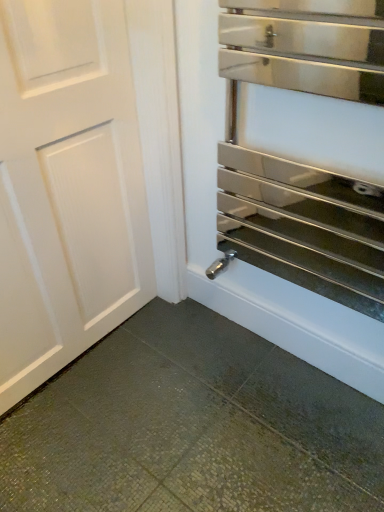
Locate an element on the screen. white matte door at left is located at coordinates (67, 187).

Describe the element at coordinates (67, 187) in the screenshot. The width and height of the screenshot is (384, 512). I see `white matte door at left` at that location.

Identify the location of polished stainless steel oven at right. pos(247,264).

The width and height of the screenshot is (384, 512). Describe the element at coordinates (247, 264) in the screenshot. I see `polished stainless steel oven at right` at that location.

Find the location of `white matte door at left`. white matte door at left is located at coordinates (67, 187).

Considering the relative positions of white matte door at left and polished stainless steel oven at right in the image provided, is white matte door at left to the right of polished stainless steel oven at right from the viewer's perspective?

No.

In the image, is white matte door at left positioned in front of or behind polished stainless steel oven at right?

white matte door at left is behind polished stainless steel oven at right.

Is point (47, 184) farther from viewer compared to point (246, 307)?

That is False.

From the image's perspective, is white matte door at left above polished stainless steel oven at right?

No.

From a real-world perspective, which object stands above the other?

From a 3D spatial view, polished stainless steel oven at right is above.

Considering the sizes of objects white matte door at left and polished stainless steel oven at right in the image provided, who is wider, white matte door at left or polished stainless steel oven at right?

Wider between the two is polished stainless steel oven at right.

In terms of height, does white matte door at left look taller or shorter compared to polished stainless steel oven at right?

Considering their sizes, white matte door at left has more height than polished stainless steel oven at right.

Considering the relative sizes of white matte door at left and polished stainless steel oven at right in the image provided, is white matte door at left bigger than polished stainless steel oven at right?

Yes, white matte door at left is bigger than polished stainless steel oven at right.

Is white matte door at left outside of polished stainless steel oven at right?

That's correct, white matte door at left is outside of polished stainless steel oven at right.

Is there a large distance between white matte door at left and polished stainless steel oven at right?

white matte door at left is near polished stainless steel oven at right, not far away.

Is white matte door at left oriented towards polished stainless steel oven at right?

Yes, white matte door at left faces towards polished stainless steel oven at right.

How different are the orientations of white matte door at left and polished stainless steel oven at right in degrees?

They differ by 89.5 degrees in their facing directions.

Locate an element on the screen. The image size is (384, 512). oven in front of the white matte door at left is located at coordinates (x=247, y=264).

Which object is positioned more to the left, polished stainless steel oven at right or white matte door at left?

From the viewer's perspective, white matte door at left appears more on the left side.

Is polished stainless steel oven at right further to the viewer compared to white matte door at left?

No, the depth of polished stainless steel oven at right is less than that of white matte door at left.

Which is behind, point (176, 42) or point (118, 317)?

The point (118, 317) is farther from the camera.

From the image's perspective, would you say polished stainless steel oven at right is positioned over white matte door at left?

Indeed, from the image's perspective, polished stainless steel oven at right is shown above white matte door at left.

From a real-world perspective, which is physically below, polished stainless steel oven at right or white matte door at left?

In real-world perspective, white matte door at left is lower.

Considering the sizes of objects polished stainless steel oven at right and white matte door at left in the image provided, who is wider, polished stainless steel oven at right or white matte door at left?

polished stainless steel oven at right.

Considering the relative sizes of polished stainless steel oven at right and white matte door at left in the image provided, is polished stainless steel oven at right shorter than white matte door at left?

Yes, polished stainless steel oven at right is shorter than white matte door at left.

Between polished stainless steel oven at right and white matte door at left, which one has larger size?

With larger size is white matte door at left.

Choose the correct answer: Is polished stainless steel oven at right inside white matte door at left or outside it?

polished stainless steel oven at right is not enclosed by white matte door at left.

Is polished stainless steel oven at right far from white matte door at left?

No, there isn't a large distance between polished stainless steel oven at right and white matte door at left.

Is polished stainless steel oven at right aimed at white matte door at left?

No, polished stainless steel oven at right does not turn towards white matte door at left.

How many degrees apart are the facing directions of polished stainless steel oven at right and white matte door at left?

The angular difference between polished stainless steel oven at right and white matte door at left is 89.5 degrees.

Where is `door below the polished stainless steel oven at right (from a real-world perspective)`? The image size is (384, 512). door below the polished stainless steel oven at right (from a real-world perspective) is located at coordinates (67, 187).

Where is `oven in front of the white matte door at left`? This screenshot has height=512, width=384. oven in front of the white matte door at left is located at coordinates (247, 264).

At what (x,y) coordinates should I click in order to perform the action: click on door on the left of the polished stainless steel oven at right. Please return your answer as a coordinate pair (x, y). Looking at the image, I should click on (67, 187).